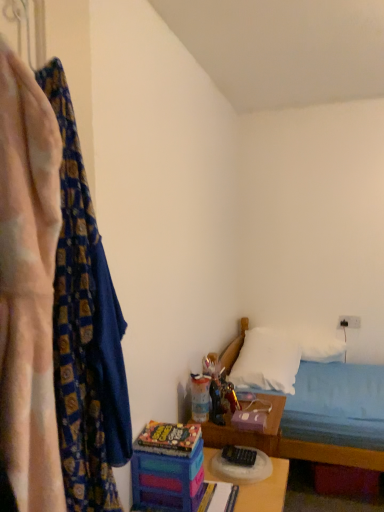
Question: Can you confirm if translucent plastic toy at center, positioned as the 2th toy in left-to-right order, is shorter than multicolored plastic toy at lower center, the 2th toy in the back-to-front sequence?

Choices:
 (A) yes
 (B) no

Answer: (B)

Question: Is translucent plastic toy at center, which is counted as the first toy, starting from the back, facing towards multicolored plastic toy at lower center, which is the 1th toy in left-to-right order?

Choices:
 (A) yes
 (B) no

Answer: (B)

Question: From the image's perspective, would you say translucent plastic toy at center, positioned as the 2th toy in left-to-right order, is shown under multicolored plastic toy at lower center, arranged as the second toy when viewed from the right?

Choices:
 (A) yes
 (B) no

Answer: (B)

Question: Is translucent plastic toy at center, which is counted as the first toy, starting from the back, completely or partially outside of multicolored plastic toy at lower center, arranged as the second toy when viewed from the right?

Choices:
 (A) no
 (B) yes

Answer: (B)

Question: Is translucent plastic toy at center, the second toy in the front-to-back sequence, positioned with its back to multicolored plastic toy at lower center, which ranks as the first toy in front-to-back order?

Choices:
 (A) no
 (B) yes

Answer: (A)

Question: Considering the positions of white soft pillow at upper right, the first pillow in the back-to-front sequence, and patterned fabric curtain at left, marked as the second curtain in a front-to-back arrangement, in the image, is white soft pillow at upper right, the first pillow in the back-to-front sequence, bigger or smaller than patterned fabric curtain at left, marked as the second curtain in a front-to-back arrangement,?

Choices:
 (A) big
 (B) small

Answer: (A)

Question: Considering the positions of point (301, 348) and point (71, 309), is point (301, 348) closer or farther from the camera than point (71, 309)?

Choices:
 (A) farther
 (B) closer

Answer: (A)

Question: Is white soft pillow at upper right, which appears as the second pillow when viewed from the front, inside the boundaries of patterned fabric curtain at left, marked as the second curtain in a front-to-back arrangement, or outside?

Choices:
 (A) outside
 (B) inside

Answer: (A)

Question: From a real-world perspective, is white soft pillow at upper right, which appears as the second pillow when viewed from the front, positioned above or below patterned fabric curtain at left, the first curtain viewed from the back?

Choices:
 (A) above
 (B) below

Answer: (B)

Question: Based on their sizes in the image, would you say white fabric bed at lower right is bigger or smaller than multicolored plastic table at center?

Choices:
 (A) big
 (B) small

Answer: (A)

Question: In terms of width, does white fabric bed at lower right look wider or thinner when compared to multicolored plastic table at center?

Choices:
 (A) wide
 (B) thin

Answer: (A)

Question: In the image, is white fabric bed at lower right on the left side or the right side of multicolored plastic table at center?

Choices:
 (A) right
 (B) left

Answer: (A)

Question: Is point (291, 443) positioned closer to the camera than point (248, 495)?

Choices:
 (A) farther
 (B) closer

Answer: (A)

Question: Is white soft pillow at lower right, the 1th pillow from the front, taller or shorter than white soft pillow at upper right, which appears as the second pillow when viewed from the front?

Choices:
 (A) tall
 (B) short

Answer: (B)

Question: Looking at the image, does white soft pillow at lower right, the 2th pillow in the back-to-front sequence, seem bigger or smaller compared to white soft pillow at upper right, the first pillow in the back-to-front sequence?

Choices:
 (A) small
 (B) big

Answer: (B)